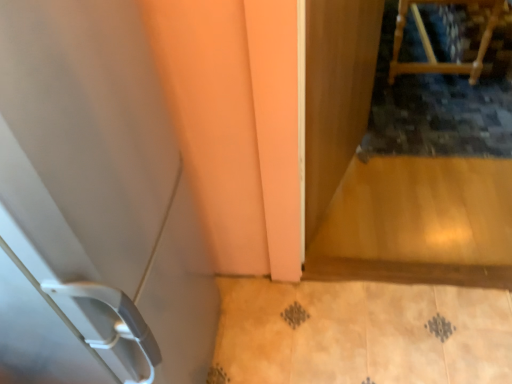
Question: Is white plastic door at left to the left or to the right of transparent wooden screen door at upper right in the image?

Choices:
 (A) left
 (B) right

Answer: (A)

Question: Considering the positions of white plastic door at left and transparent wooden screen door at upper right in the image, is white plastic door at left wider or thinner than transparent wooden screen door at upper right?

Choices:
 (A) wide
 (B) thin

Answer: (A)

Question: Considering the real-world distances, which object is closest to the wooden chair at upper right?

Choices:
 (A) white plastic door at left
 (B) transparent wooden screen door at upper right

Answer: (B)

Question: Which object is positioned closest to the wooden chair at upper right?

Choices:
 (A) white plastic door at left
 (B) transparent wooden screen door at upper right

Answer: (B)